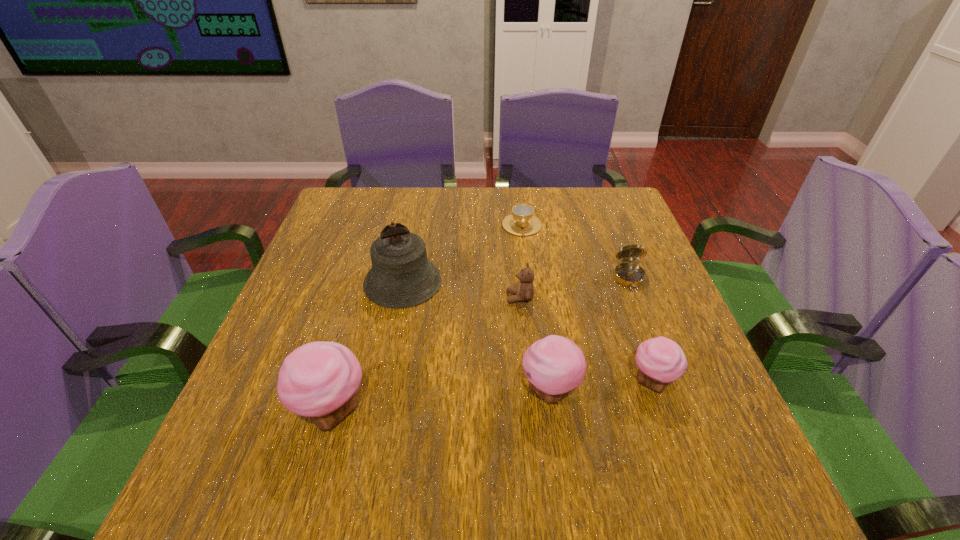
To achieve uniform spacing by inserting another cupcake among them, please point to a free space for this new cupcake. Please provide its 2D coordinates. Your answer should be formatted as a tuple, i.e. [(x, y)], where the tuple contains the x and y coordinates of a point satisfying the conditions above.

[(444, 401)]